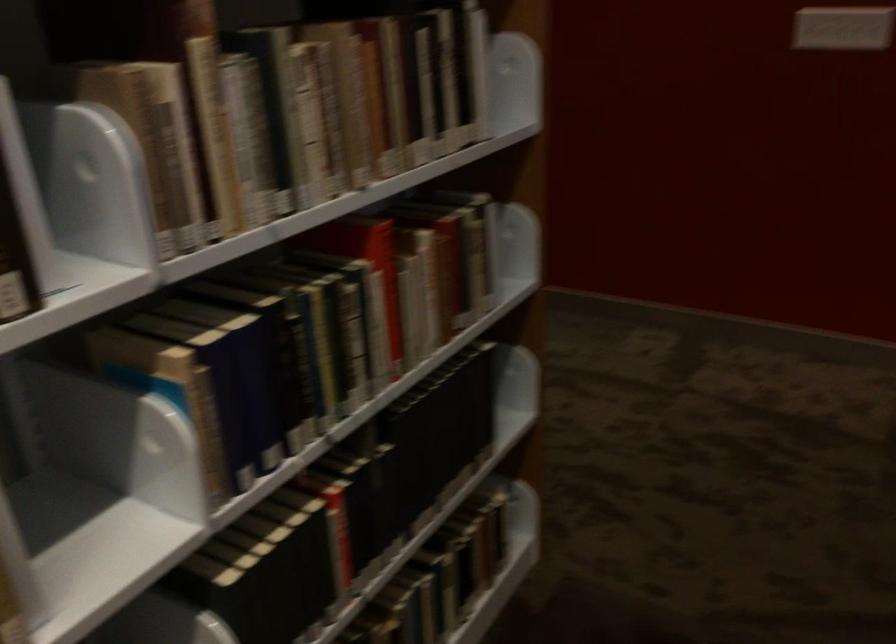
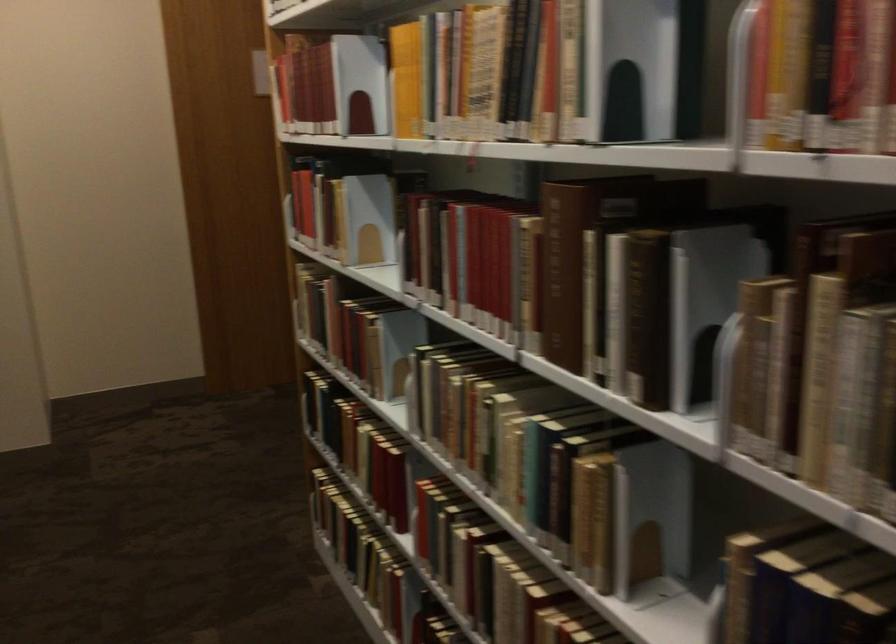
Locate, in the second image, the point that corresponds to the point at 147,160 in the first image.

(743, 363)